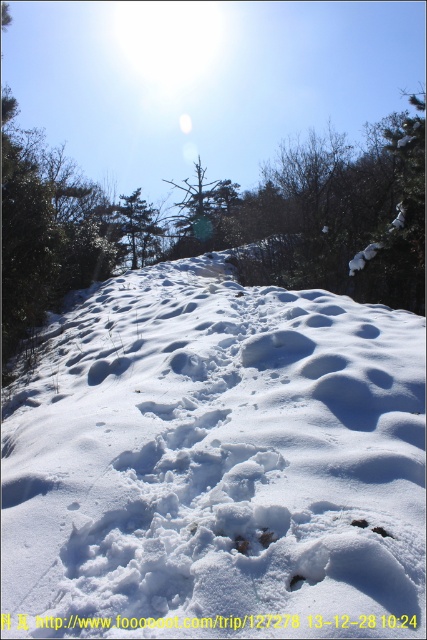
Is white fluffy snow at center to the left of green matte tree at center from the viewer's perspective?

Incorrect, white fluffy snow at center is not on the left side of green matte tree at center.

Based on the photo, is white fluffy snow at center above green matte tree at center?

Incorrect, white fluffy snow at center is not positioned above green matte tree at center.

Is point (315, 376) closer to camera compared to point (190, 200)?

Yes, it is.

Locate an element on the screen. This screenshot has width=427, height=640. white fluffy snow at center is located at coordinates tap(215, 464).

Which is more to the right, green matte tree at center or green matte tree at upper center?

Positioned to the right is green matte tree at center.

Between point (193, 220) and point (143, 262), which one is positioned behind?

Positioned behind is point (193, 220).

Where is `green matte tree at center`? green matte tree at center is located at coordinates (201, 212).

Is white fluffy snow at center in front of green matte tree at upper center?

Yes, white fluffy snow at center is in front of green matte tree at upper center.

Is point (344, 564) more distant than point (140, 237)?

No, it is in front of (140, 237).

Locate an element on the screen. white fluffy snow at center is located at coordinates (215, 464).